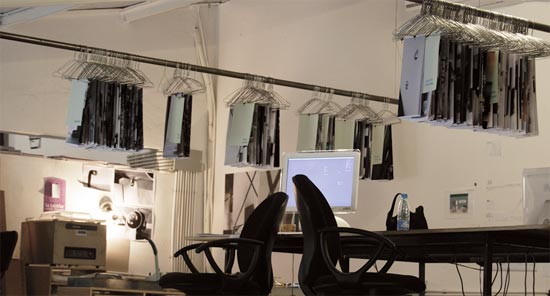
Locate an element on the screen. The width and height of the screenshot is (550, 296). pictures on wall is located at coordinates (55, 193), (95, 176), (140, 185), (148, 218), (456, 202), (492, 201), (497, 166).